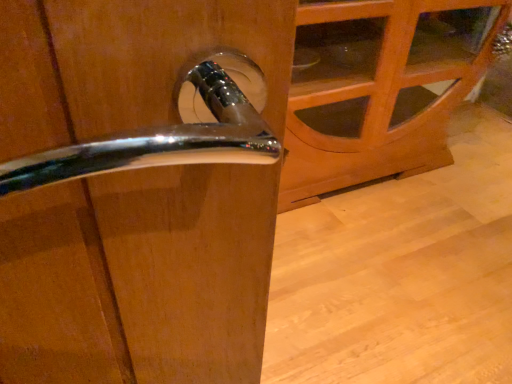
Locate an element on the screen. free space in front of glossy wood cabinet at center is located at coordinates (382, 264).